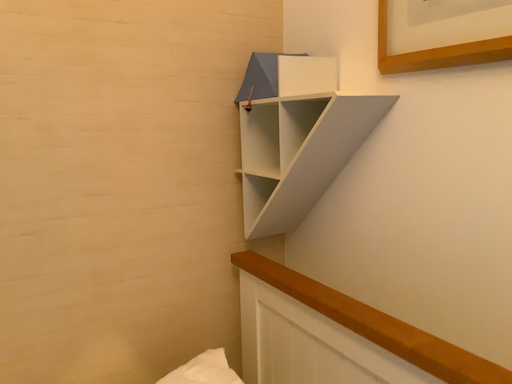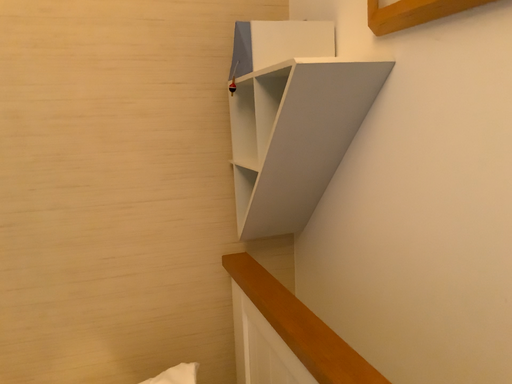
Question: Which way did the camera rotate in the video?

Choices:
 (A) rotated left
 (B) rotated right

Answer: (A)